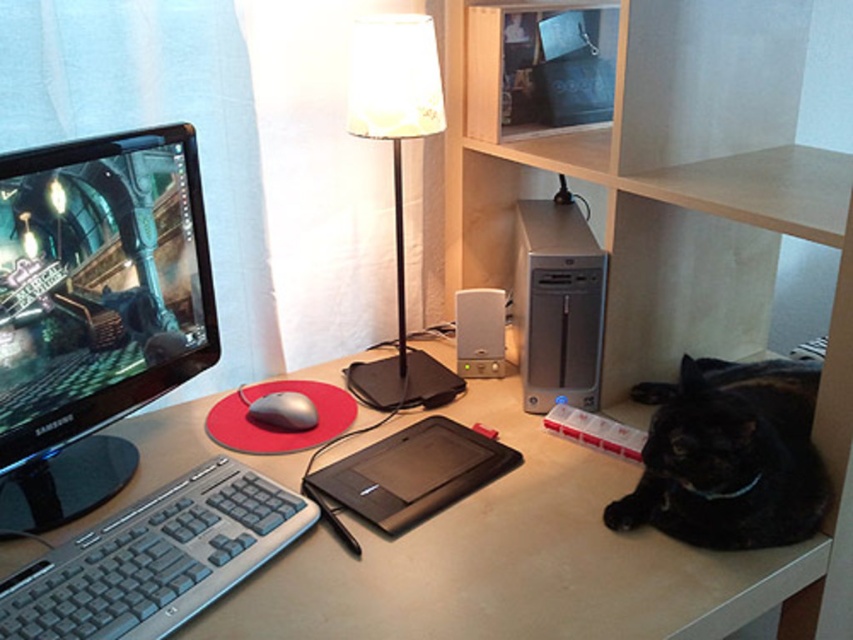
Is matte white table at center bigger than black plastic keyboard at lower left?

Yes.

The image size is (853, 640). I want to click on matte white table at center, so click(x=514, y=563).

Between point (439, 595) and point (410, 397), which one is positioned in front?

Positioned in front is point (439, 595).

What do you see at coordinates (514, 563) in the screenshot?
I see `matte white table at center` at bounding box center [514, 563].

Locate an element on the screen. This screenshot has width=853, height=640. matte white table at center is located at coordinates (514, 563).

Who is positioned more to the left, black matte drawing tablet at center or satin silver mouse at center?

satin silver mouse at center

Looking at this image, measure the distance between black matte drawing tablet at center and camera.

They are 38.85 inches apart.

Between point (364, 492) and point (260, 400), which one is positioned in front?

Positioned in front is point (364, 492).

The height and width of the screenshot is (640, 853). Identify the location of black matte drawing tablet at center. (409, 474).